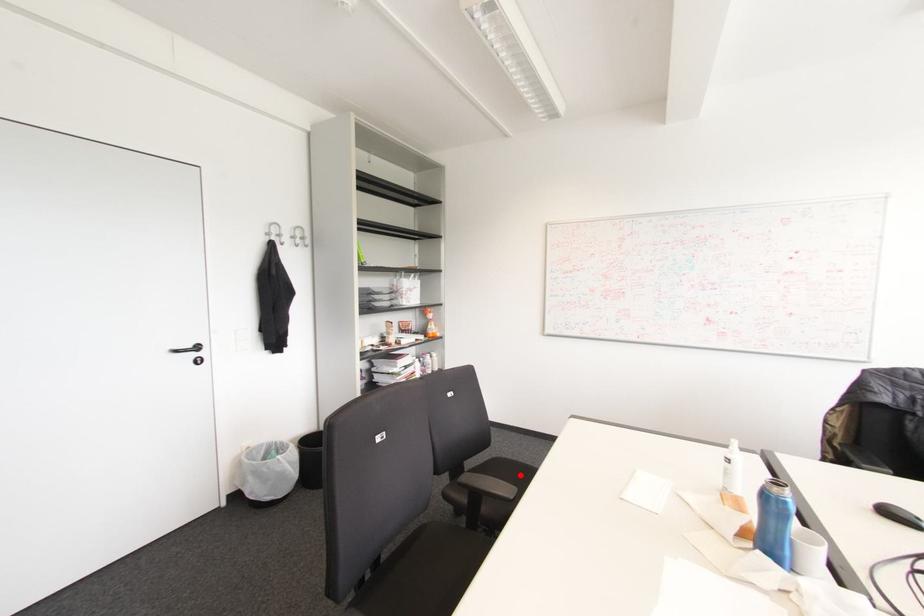
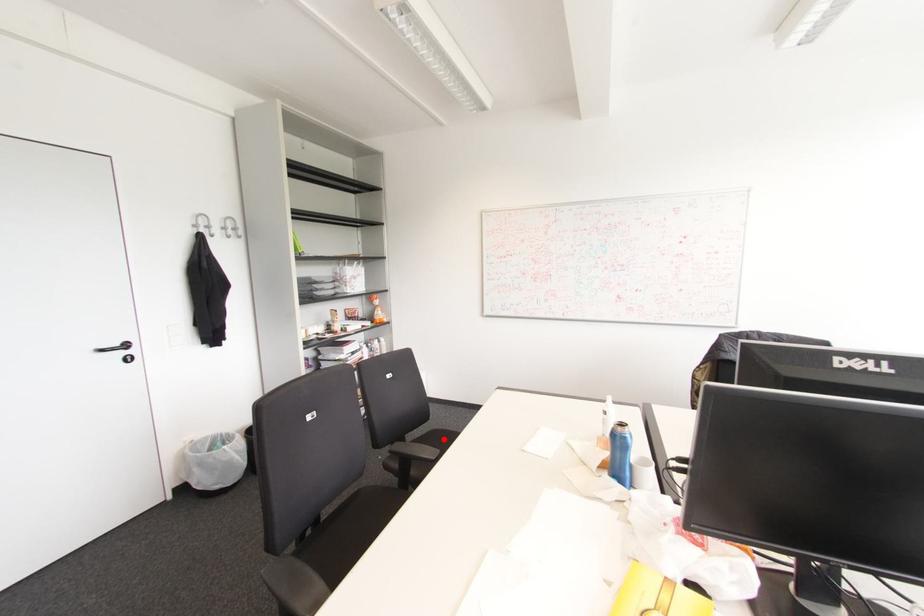
I am providing you with two images of the same scene from different viewpoints. A red point is marked on the first image and another point is marked on the second image. Are the points marked in image1 and image2 representing the same 3D position?

Yes